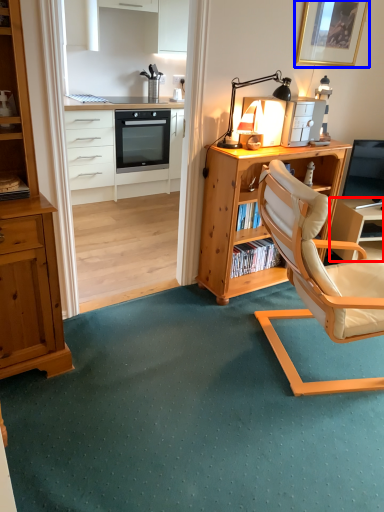
Question: Which point is closer to the camera, table (highlighted by a red box) or picture frame (highlighted by a blue box)?

Choices:
 (A) table
 (B) picture frame

Answer: (B)